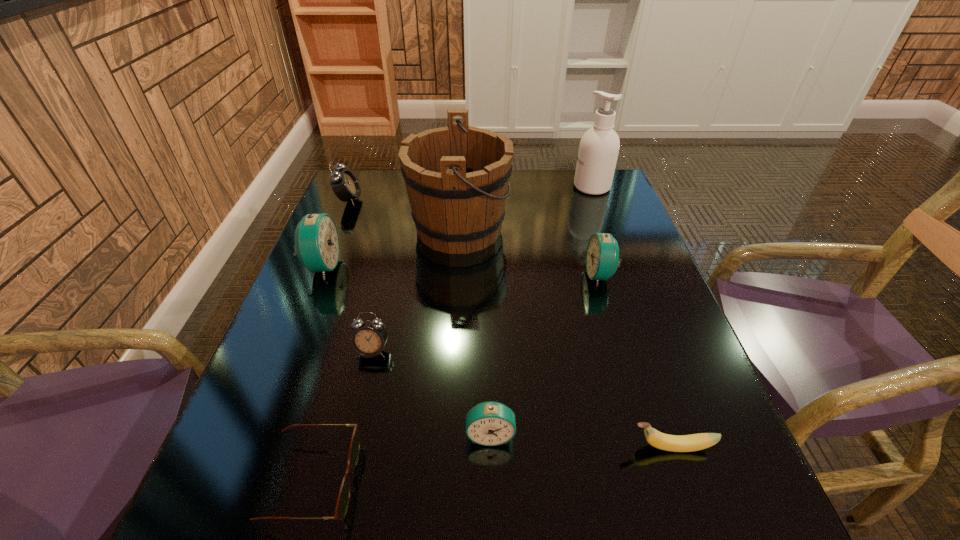
Image resolution: width=960 pixels, height=540 pixels. Identify the location of free space between the leftmost blue alarm clock and the nearest alarm clock. (406, 350).

Find the location of `vacant region between the banana and the cleansing agent`. vacant region between the banana and the cleansing agent is located at coordinates (632, 316).

The image size is (960, 540). In order to click on vacant area that lies between the second smallest blue alarm clock and the cleansing agent in this screenshot , I will do `click(596, 231)`.

Locate an element on the screen. The image size is (960, 540). vacant area that lies between the wine bucket and the third alarm clock from right to left is located at coordinates (416, 289).

What are the coordinates of `vacant area between the wine bucket and the shortest object` in the screenshot? It's located at (386, 354).

At what (x,y) coordinates should I click in order to perform the action: click on empty location between the brown spectacles and the tallest alarm clock. Please return your answer as a coordinate pair (x, y). Image resolution: width=960 pixels, height=540 pixels. Looking at the image, I should click on (318, 374).

Locate which object ranks eighth in proximity to the right white alarm clock. Please provide its 2D coordinates. Your answer should be formatted as a tuple, i.e. [(x, y)], where the tuple contains the x and y coordinates of a point satisfying the conditions above.

[(598, 151)]

Find the location of `the closest object to the spectacles`. the closest object to the spectacles is located at coordinates (369, 337).

The image size is (960, 540). What are the coordinates of `alarm clock that is the second closest to the right white alarm clock` in the screenshot? It's located at (490, 423).

The image size is (960, 540). Find the location of `the second closest alarm clock relative to the rightmost blue alarm clock`. the second closest alarm clock relative to the rightmost blue alarm clock is located at coordinates (369, 337).